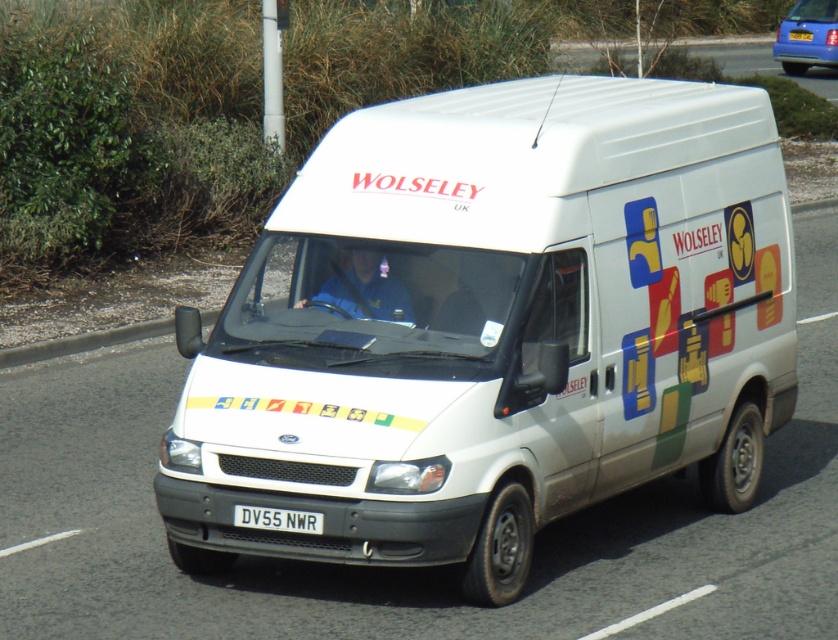
Question: Which object is positioned closest to the blue metallic car at upper right?

Choices:
 (A) white plastic license plate at center
 (B) white matte van at center

Answer: (B)

Question: Estimate the real-world distances between objects in this image. Which object is closer to the white matte van at center?

Choices:
 (A) white plastic license plate at center
 (B) blue metallic car at upper right

Answer: (A)

Question: Considering the relative positions of white matte van at center and blue metallic car at upper right in the image provided, where is white matte van at center located with respect to blue metallic car at upper right?

Choices:
 (A) right
 (B) left

Answer: (B)

Question: Is white matte van at center wider than white plastic license plate at center?

Choices:
 (A) no
 (B) yes

Answer: (B)

Question: Can you confirm if white matte van at center is positioned to the right of blue metallic car at upper right?

Choices:
 (A) no
 (B) yes

Answer: (A)

Question: Considering the real-world distances, which object is closest to the white plastic license plate at center?

Choices:
 (A) blue metallic car at upper right
 (B) white matte van at center

Answer: (B)